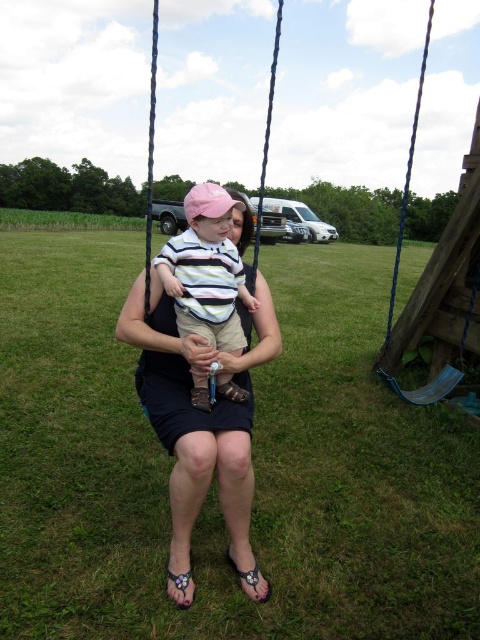
Question: Which object is closer to the camera taking this photo?

Choices:
 (A) matte black dress at center
 (B) black fabric sandal at lower center
 (C) black leather sandal at lower center
 (D) wooden swing at center

Answer: (A)

Question: Which point is farther from the camera taking this photo?

Choices:
 (A) (186, 584)
 (B) (243, 576)
 (C) (267, 124)

Answer: (C)

Question: Can you confirm if wooden swing at center is bigger than black fabric sandal at lower center?

Choices:
 (A) yes
 (B) no

Answer: (A)

Question: Which of the following is the closest to the observer?

Choices:
 (A) (207, 472)
 (B) (260, 602)
 (C) (271, 109)
 (D) (208, 260)

Answer: (A)

Question: Is matte black dress at center above black leather sandal at lower center?

Choices:
 (A) no
 (B) yes

Answer: (B)

Question: Does matte black dress at center appear on the right side of striped cotton shirt at center?

Choices:
 (A) no
 (B) yes

Answer: (A)